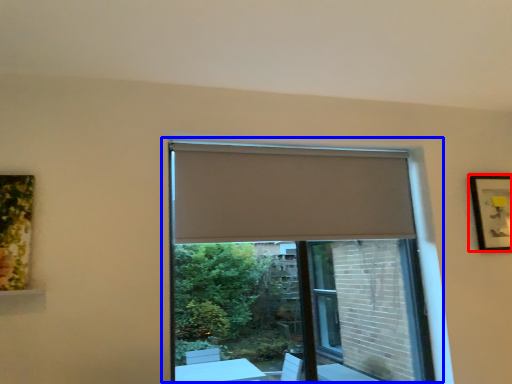
Question: Which point is further to the camera, picture frame (highlighted by a red box) or window (highlighted by a blue box)?

Choices:
 (A) picture frame
 (B) window

Answer: (A)